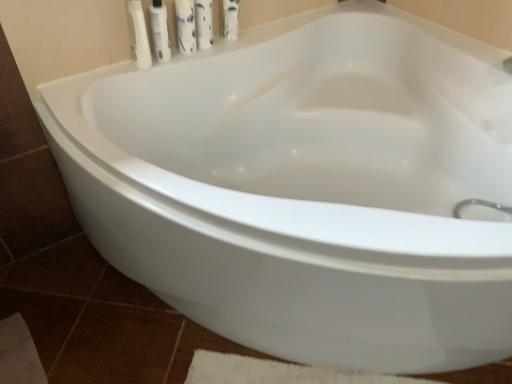
What is the approximate height of white glossy bottle at upper left, the 1th toiletry viewed from the right?

7.94 inches.

Describe the element at coordinates (138, 35) in the screenshot. I see `white plastic tube at upper left, acting as the second toiletry starting from the right` at that location.

Locate an element on the screen. white glossy bottle at upper left, the 1th toiletry viewed from the right is located at coordinates (160, 31).

Between point (185, 40) and point (223, 2), which one is positioned in front?

Point (185, 40)

From a real-world perspective, is white glossy bottle at upper left, the first cleaning product when ordered from left to right, positioned under white glossy mouthwash at upper center based on gravity?

No.

Considering the sizes of objects white glossy bottle at upper left, the first cleaning product when ordered from left to right, and white glossy mouthwash at upper center in the image provided, who is wider, white glossy bottle at upper left, the first cleaning product when ordered from left to right, or white glossy mouthwash at upper center?

white glossy mouthwash at upper center.

Is white glossy bottle at upper left, the first cleaning product when ordered from left to right, at the right side of white glossy mouthwash at upper center?

In fact, white glossy bottle at upper left, the first cleaning product when ordered from left to right, is to the left of white glossy mouthwash at upper center.

Which point is more distant from viewer, (163, 16) or (177, 11)?

The point (163, 16) is more distant.

Is white glossy bottle at upper left, the 1th toiletry viewed from the right, to the left of white glossy bottle at upper left, the first cleaning product when ordered from left to right, from the viewer's perspective?

Yes.

Is white glossy bottle at upper left, the 2th toiletry viewed from the left, shorter than white glossy bottle at upper left, which is the 2th cleaning product from right to left?

Yes.

Could you tell me if white glossy bottle at upper left, the 2th toiletry viewed from the left, is facing white glossy bottle at upper left, the first cleaning product when ordered from left to right?

No, white glossy bottle at upper left, the 2th toiletry viewed from the left, is not oriented towards white glossy bottle at upper left, the first cleaning product when ordered from left to right.

Considering the points (185, 29) and (212, 9), which point is behind, point (185, 29) or point (212, 9)?

Positioned behind is point (212, 9).

From a real-world perspective, is white glossy bottle at upper left, the first cleaning product when ordered from left to right, below white glossy bottle at upper center, the 2th cleaning product when ordered from left to right?

Actually, white glossy bottle at upper left, the first cleaning product when ordered from left to right, is physically above white glossy bottle at upper center, the 2th cleaning product when ordered from left to right, in the real world.

This screenshot has width=512, height=384. Identify the location of cleaning product above the white glossy bottle at upper center, which is counted as the 1th cleaning product, starting from the right (from a real-world perspective). (186, 26).

Could you tell me if white glossy bottle at upper left, the first cleaning product when ordered from left to right, is facing white glossy bottle at upper center, which is counted as the 1th cleaning product, starting from the right?

No, white glossy bottle at upper left, the first cleaning product when ordered from left to right, is not facing towards white glossy bottle at upper center, which is counted as the 1th cleaning product, starting from the right.

Is white plastic tube at upper left, acting as the second toiletry starting from the right, bigger than white glossy bottle at upper center, the 2th cleaning product when ordered from left to right?

Indeed, white plastic tube at upper left, acting as the second toiletry starting from the right, has a larger size compared to white glossy bottle at upper center, the 2th cleaning product when ordered from left to right.

Is white plastic tube at upper left, arranged as the 1th toiletry when viewed from the left, oriented away from white glossy bottle at upper center, the 2th cleaning product when ordered from left to right?

No, white plastic tube at upper left, arranged as the 1th toiletry when viewed from the left, is not facing away from white glossy bottle at upper center, the 2th cleaning product when ordered from left to right.

Is white plastic tube at upper left, acting as the second toiletry starting from the right, beside white glossy bottle at upper center, which is counted as the 1th cleaning product, starting from the right?

No.

Is the position of white glossy mouthwash at upper center more distant than that of white plastic tube at upper left, acting as the second toiletry starting from the right?

Yes, white glossy mouthwash at upper center is behind white plastic tube at upper left, acting as the second toiletry starting from the right.

In terms of size, does white glossy mouthwash at upper center appear bigger or smaller than white plastic tube at upper left, acting as the second toiletry starting from the right?

In the image, white glossy mouthwash at upper center appears to be smaller than white plastic tube at upper left, acting as the second toiletry starting from the right.

Does point (236, 20) appear closer or farther from the camera than point (139, 2)?

Point (236, 20) is farther from the camera than point (139, 2).

Is white glossy mouthwash at upper center thinner than white plastic tube at upper left, acting as the second toiletry starting from the right?

Correct, the width of white glossy mouthwash at upper center is less than that of white plastic tube at upper left, acting as the second toiletry starting from the right.

Is white glossy bottle at upper left, the 2th toiletry viewed from the left, thinner than white glossy mouthwash at upper center?

Yes, white glossy bottle at upper left, the 2th toiletry viewed from the left, is thinner than white glossy mouthwash at upper center.

Would you consider white glossy bottle at upper left, the 2th toiletry viewed from the left, to be distant from white glossy mouthwash at upper center?

Actually, white glossy bottle at upper left, the 2th toiletry viewed from the left, and white glossy mouthwash at upper center are a little close together.

Is white glossy bottle at upper left, the 2th toiletry viewed from the left, further to the viewer compared to white glossy mouthwash at upper center?

No, it is not.

Does point (160, 12) come farther from viewer compared to point (230, 14)?

That is False.

Is white glossy bottle at upper left, which is the 2th cleaning product from right to left, to the left or to the right of white plastic tube at upper left, arranged as the 1th toiletry when viewed from the left, in the image?

white glossy bottle at upper left, which is the 2th cleaning product from right to left, is positioned on white plastic tube at upper left, arranged as the 1th toiletry when viewed from the left,'s right side.

Is white glossy bottle at upper left, the first cleaning product when ordered from left to right, oriented away from white plastic tube at upper left, arranged as the 1th toiletry when viewed from the left?

white glossy bottle at upper left, the first cleaning product when ordered from left to right, is not turned away from white plastic tube at upper left, arranged as the 1th toiletry when viewed from the left.

I want to click on mouthwash located behind the white glossy bottle at upper left, which is the 2th cleaning product from right to left, so click(230, 19).

Locate an element on the screen. the 2nd cleaning product positioned above the white glossy bottle at upper left, the 1th toiletry viewed from the right (from a real-world perspective) is located at coordinates (186, 26).

Estimate the real-world distances between objects in this image. Which object is further from white plastic tube at upper left, acting as the second toiletry starting from the right, white glossy bottle at upper center, which is counted as the 1th cleaning product, starting from the right, or white glossy bottle at upper left, the 2th toiletry viewed from the left?

Based on the image, white glossy bottle at upper center, which is counted as the 1th cleaning product, starting from the right, appears to be further to white plastic tube at upper left, acting as the second toiletry starting from the right.

Based on their spatial positions, is white glossy mouthwash at upper center or white plastic tube at upper left, acting as the second toiletry starting from the right, closer to white glossy bottle at upper left, which is the 2th cleaning product from right to left?

white plastic tube at upper left, acting as the second toiletry starting from the right.

Which object lies further to the anchor point white glossy bottle at upper left, the 2th toiletry viewed from the left, white plastic tube at upper left, arranged as the 1th toiletry when viewed from the left, or white glossy bottle at upper center, the 2th cleaning product when ordered from left to right?

The object further to white glossy bottle at upper left, the 2th toiletry viewed from the left, is white glossy bottle at upper center, the 2th cleaning product when ordered from left to right.

From the image, which object appears to be farther from white glossy bottle at upper center, which is counted as the 1th cleaning product, starting from the right, white glossy bottle at upper left, the 1th toiletry viewed from the right, or white glossy mouthwash at upper center?

Among the two, white glossy bottle at upper left, the 1th toiletry viewed from the right, is located further to white glossy bottle at upper center, which is counted as the 1th cleaning product, starting from the right.

When comparing their distances from white glossy bottle at upper left, the first cleaning product when ordered from left to right, does white glossy bottle at upper center, the 2th cleaning product when ordered from left to right, or white glossy bottle at upper left, the 1th toiletry viewed from the right, seem closer?

white glossy bottle at upper center, the 2th cleaning product when ordered from left to right, is closer to white glossy bottle at upper left, the first cleaning product when ordered from left to right.

In the scene shown: When comparing their distances from white glossy mouthwash at upper center, does white glossy bottle at upper center, the 2th cleaning product when ordered from left to right, or white glossy bottle at upper left, the first cleaning product when ordered from left to right, seem closer?

Among the two, white glossy bottle at upper center, the 2th cleaning product when ordered from left to right, is located nearer to white glossy mouthwash at upper center.

Estimate the real-world distances between objects in this image. Which object is closer to white glossy mouthwash at upper center, white glossy bottle at upper left, which is the 2th cleaning product from right to left, or white glossy bottle at upper left, the 1th toiletry viewed from the right?

white glossy bottle at upper left, which is the 2th cleaning product from right to left.

From the image, which object appears to be nearer to white glossy bottle at upper left, the 2th toiletry viewed from the left, white glossy bottle at upper left, which is the 2th cleaning product from right to left, or white plastic tube at upper left, acting as the second toiletry starting from the right?

white glossy bottle at upper left, which is the 2th cleaning product from right to left, lies closer to white glossy bottle at upper left, the 2th toiletry viewed from the left, than the other object.

Find the location of `cleaning product between white glossy bottle at upper left, the first cleaning product when ordered from left to right, and white glossy mouthwash at upper center`. cleaning product between white glossy bottle at upper left, the first cleaning product when ordered from left to right, and white glossy mouthwash at upper center is located at coordinates (204, 23).

This screenshot has height=384, width=512. What are the coordinates of `cleaning product between white plastic tube at upper left, acting as the second toiletry starting from the right, and white glossy bottle at upper center, which is counted as the 1th cleaning product, starting from the right` in the screenshot? It's located at (186, 26).

Where is `toiletry between white plastic tube at upper left, arranged as the 1th toiletry when viewed from the left, and white glossy bottle at upper center, the 2th cleaning product when ordered from left to right, from left to right`? Image resolution: width=512 pixels, height=384 pixels. toiletry between white plastic tube at upper left, arranged as the 1th toiletry when viewed from the left, and white glossy bottle at upper center, the 2th cleaning product when ordered from left to right, from left to right is located at coordinates (160, 31).

Find the location of a particular element. toiletry located between white plastic tube at upper left, acting as the second toiletry starting from the right, and white glossy mouthwash at upper center in the left-right direction is located at coordinates (160, 31).